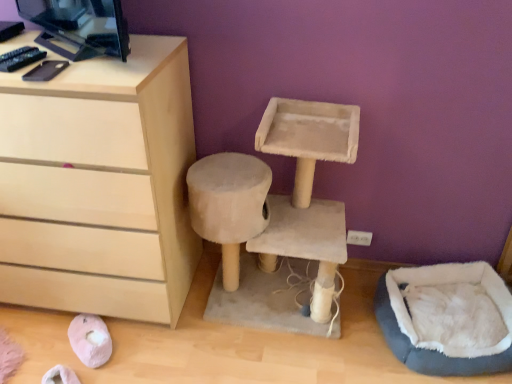
Question: From a real-world perspective, is light wood chest of drawers at left below black glossy desktop computer at upper left?

Choices:
 (A) no
 (B) yes

Answer: (B)

Question: Considering the relative sizes of light wood chest of drawers at left and black glossy desktop computer at upper left in the image provided, is light wood chest of drawers at left taller than black glossy desktop computer at upper left?

Choices:
 (A) yes
 (B) no

Answer: (A)

Question: Are light wood chest of drawers at left and black glossy desktop computer at upper left far apart?

Choices:
 (A) yes
 (B) no

Answer: (B)

Question: From the image's perspective, is light wood chest of drawers at left below black glossy desktop computer at upper left?

Choices:
 (A) yes
 (B) no

Answer: (A)

Question: From a real-world perspective, is light wood chest of drawers at left on black glossy desktop computer at upper left?

Choices:
 (A) yes
 (B) no

Answer: (B)

Question: Considering the positions of beige fabric cat tree at center and blue fuzzy bean bag at lower right in the image, is beige fabric cat tree at center bigger or smaller than blue fuzzy bean bag at lower right?

Choices:
 (A) big
 (B) small

Answer: (A)

Question: Visually, is beige fabric cat tree at center positioned to the left or to the right of blue fuzzy bean bag at lower right?

Choices:
 (A) right
 (B) left

Answer: (B)

Question: Is beige fabric cat tree at center spatially inside blue fuzzy bean bag at lower right, or outside of it?

Choices:
 (A) inside
 (B) outside

Answer: (B)

Question: Is beige fabric cat tree at center wider or thinner than blue fuzzy bean bag at lower right?

Choices:
 (A) thin
 (B) wide

Answer: (A)

Question: Is black glossy desktop computer at upper left inside or outside of blue fuzzy bean bag at lower right?

Choices:
 (A) inside
 (B) outside

Answer: (B)

Question: Considering the positions of black glossy desktop computer at upper left and blue fuzzy bean bag at lower right in the image, is black glossy desktop computer at upper left bigger or smaller than blue fuzzy bean bag at lower right?

Choices:
 (A) big
 (B) small

Answer: (B)

Question: Would you say black glossy desktop computer at upper left is to the left or to the right of blue fuzzy bean bag at lower right in the picture?

Choices:
 (A) right
 (B) left

Answer: (B)

Question: Considering the positions of point (73, 8) and point (507, 349), is point (73, 8) closer or farther from the camera than point (507, 349)?

Choices:
 (A) farther
 (B) closer

Answer: (B)

Question: Looking at the image, does light wood chest of drawers at left seem bigger or smaller compared to black glossy desktop computer at upper left?

Choices:
 (A) big
 (B) small

Answer: (A)

Question: Considering the positions of point (41, 188) and point (81, 36), is point (41, 188) closer or farther from the camera than point (81, 36)?

Choices:
 (A) farther
 (B) closer

Answer: (A)